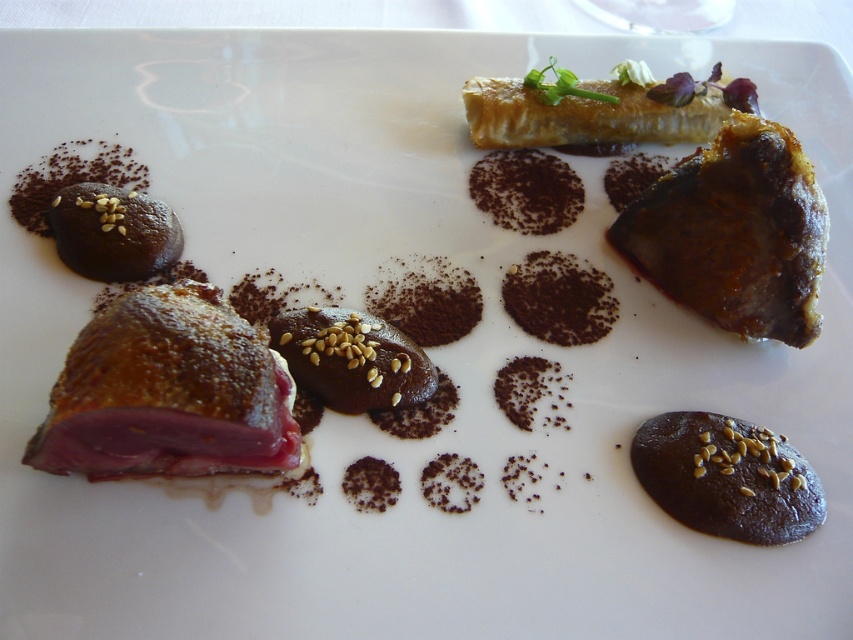
Which is more to the left, savory brown crumbly pastry at upper right or dark chocolate cookie at center?

dark chocolate cookie at center

Which is above, savory brown crumbly pastry at upper right or dark chocolate cookie at center?

savory brown crumbly pastry at upper right is higher up.

The height and width of the screenshot is (640, 853). What are the coordinates of `savory brown crumbly pastry at upper right` in the screenshot? It's located at (735, 232).

Who is more distant from viewer, (815,477) or (712,124)?

The point (712,124) is more distant.

Is dark chocolate cookie at center further to the viewer compared to golden brown flaky pastry at upper right?

No.

The image size is (853, 640). Describe the element at coordinates (727, 477) in the screenshot. I see `dark chocolate cookie at center` at that location.

Where is `dark chocolate cookie at center`? The height and width of the screenshot is (640, 853). dark chocolate cookie at center is located at coordinates (727, 477).

How much distance is there between savory brown crumbly pastry at upper right and golden brown flaky pastry at upper right?

savory brown crumbly pastry at upper right is 8.51 inches from golden brown flaky pastry at upper right.

Does savory brown crumbly pastry at upper right appear under golden brown flaky pastry at upper right?

Yes.

Locate an element on the screen. savory brown crumbly pastry at upper right is located at coordinates (735, 232).

The width and height of the screenshot is (853, 640). In order to click on savory brown crumbly pastry at upper right in this screenshot , I will do `click(735, 232)`.